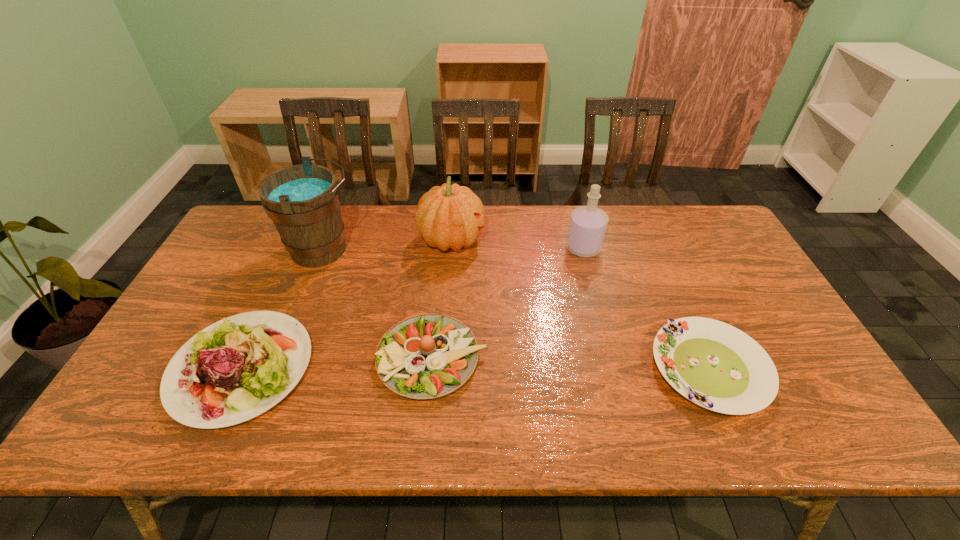
Image resolution: width=960 pixels, height=540 pixels. Identify the location of vacant space at the far edge of the desktop. (389, 220).

In the image, there is a desktop. Where is `vacant area at the near edge`? The height and width of the screenshot is (540, 960). vacant area at the near edge is located at coordinates (436, 421).

The image size is (960, 540). In the image, there is a desktop. In order to click on vacant region at the left edge in this screenshot , I will do `click(214, 277)`.

Locate an element on the screen. The width and height of the screenshot is (960, 540). vacant area at the right edge of the desktop is located at coordinates (734, 290).

Find the location of `free space at the near left corner of the desktop`. free space at the near left corner of the desktop is located at coordinates (147, 435).

I want to click on free space at the far right corner, so tap(687, 227).

You are a GUI agent. You are given a task and a screenshot of the screen. Output one action in this format:
    pyautogui.click(x=<x>, y=<y>)
    Task: Click on the vacant space in between the leftmost salad plate and the shortest salad plate
    This screenshot has height=540, width=960.
    Given the screenshot: What is the action you would take?
    pyautogui.click(x=475, y=368)

Find the location of `vacant area that lies between the leftmost salad plate and the wine bucket`. vacant area that lies between the leftmost salad plate and the wine bucket is located at coordinates (282, 309).

At what (x,y) coordinates should I click in order to perform the action: click on free space between the rightmost salad plate and the pumpkin. Please return your answer as a coordinate pair (x, y). Looking at the image, I should click on (581, 304).

Where is `unoccupied area between the wine bucket and the rightmost salad plate`? unoccupied area between the wine bucket and the rightmost salad plate is located at coordinates (516, 309).